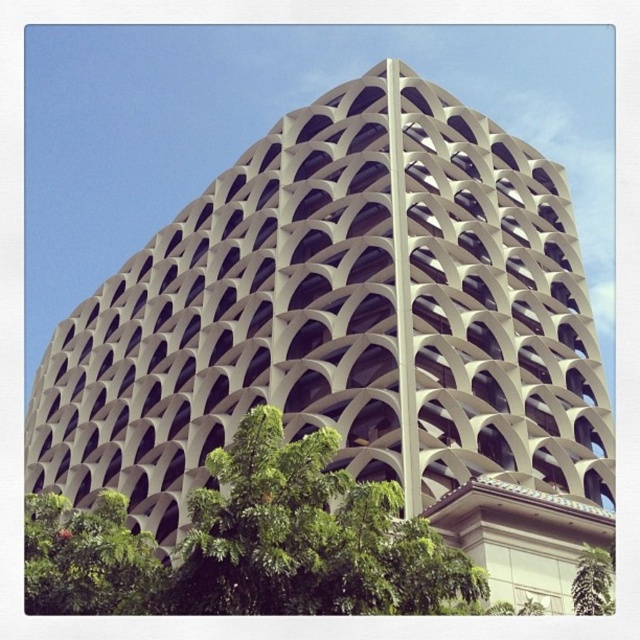
The image size is (640, 640). Describe the element at coordinates (86, 557) in the screenshot. I see `green leafy tree at lower left` at that location.

Is green leafy tree at lower left shorter than green leafy tree at lower right?

Incorrect, green leafy tree at lower left's height does not fall short of green leafy tree at lower right's.

Between point (147, 534) and point (589, 589), which one is positioned behind?

Point (147, 534)

This screenshot has height=640, width=640. In order to click on green leafy tree at lower left in this screenshot , I will do `click(86, 557)`.